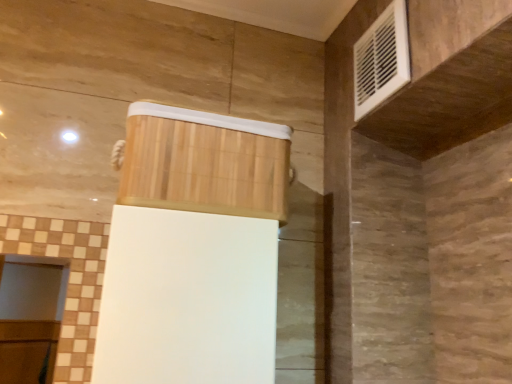
Find the location of a particular element. white plastic vent at upper right is located at coordinates (381, 59).

The width and height of the screenshot is (512, 384). What do you see at coordinates (381, 59) in the screenshot?
I see `white plastic vent at upper right` at bounding box center [381, 59].

At what (x,y) coordinates should I click in order to perform the action: click on white plastic vent at upper right. Please return your answer as a coordinate pair (x, y). The image size is (512, 384). Looking at the image, I should click on (381, 59).